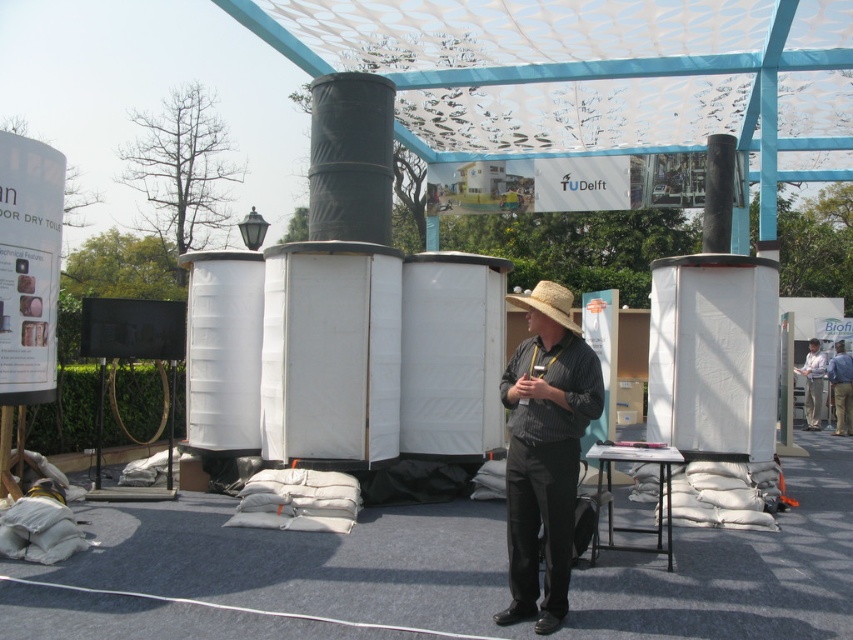
Which is more to the right, strawhat at center or light brown straw hat at center?

Positioned to the right is light brown straw hat at center.

The image size is (853, 640). What are the coordinates of `strawhat at center` in the screenshot? It's located at (548, 301).

Which is behind, point (572, 324) or point (840, 369)?

The point (840, 369) is more distant.

The height and width of the screenshot is (640, 853). What are the coordinates of `strawhat at center` in the screenshot? It's located at (548, 301).

In the scene shown: Does matte straw hat at center appear on the left side of white fabric hat at center?

Yes, matte straw hat at center is to the left of white fabric hat at center.

Measure the distance between matte straw hat at center and white fabric hat at center.

They are 13.92 meters apart.

What are the coordinates of `matte straw hat at center` in the screenshot? It's located at (544, 451).

Does light brown straw hat at center have a larger size compared to white fabric hat at center?

No, light brown straw hat at center is not bigger than white fabric hat at center.

Which is above, light brown straw hat at center or white fabric hat at center?

white fabric hat at center

Between point (843, 392) and point (817, 428), which one is positioned in front?

Point (843, 392) is in front.

Image resolution: width=853 pixels, height=640 pixels. In order to click on light brown straw hat at center in this screenshot , I will do `click(840, 388)`.